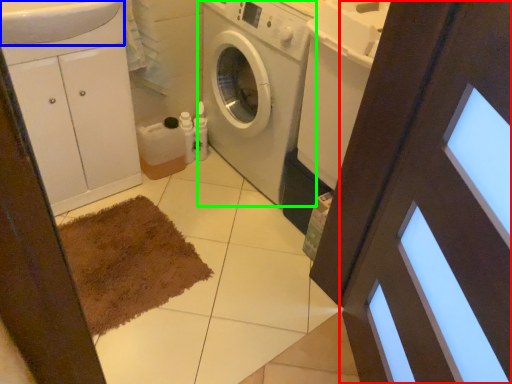
Question: Which is farther away from screen door (highlighted by a red box)? sink (highlighted by a blue box) or washing machine (highlighted by a green box)?

Choices:
 (A) sink
 (B) washing machine

Answer: (A)